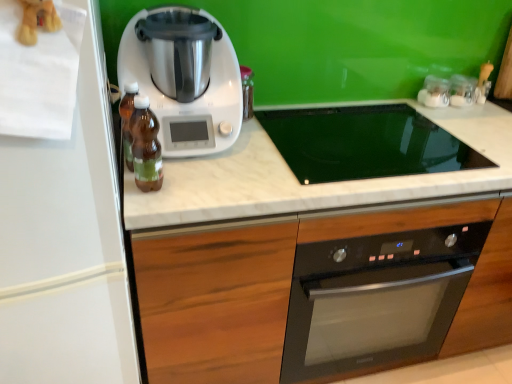
Locate an element on the screen. This screenshot has height=384, width=512. vacant space that's between brown glass bottle at center, marked as the second bottle in a back-to-front arrangement, and clear glass jars at upper right, which appears as the first appliance when viewed from the left is located at coordinates 310,140.